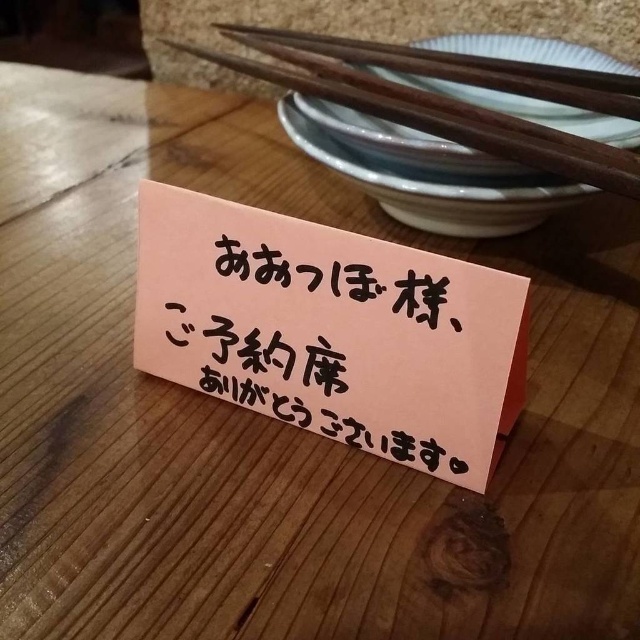
Question: Which object is farther from the camera taking this photo?

Choices:
 (A) wooden chopsticks at upper right
 (B) pink paper sign at center

Answer: (A)

Question: Is pink paper sign at center closer to camera compared to wooden chopsticks at upper right?

Choices:
 (A) yes
 (B) no

Answer: (A)

Question: Is pink paper sign at center bigger than wooden chopsticks at upper right?

Choices:
 (A) no
 (B) yes

Answer: (A)

Question: Is pink paper sign at center closer to the viewer compared to wooden chopsticks at upper right?

Choices:
 (A) yes
 (B) no

Answer: (A)